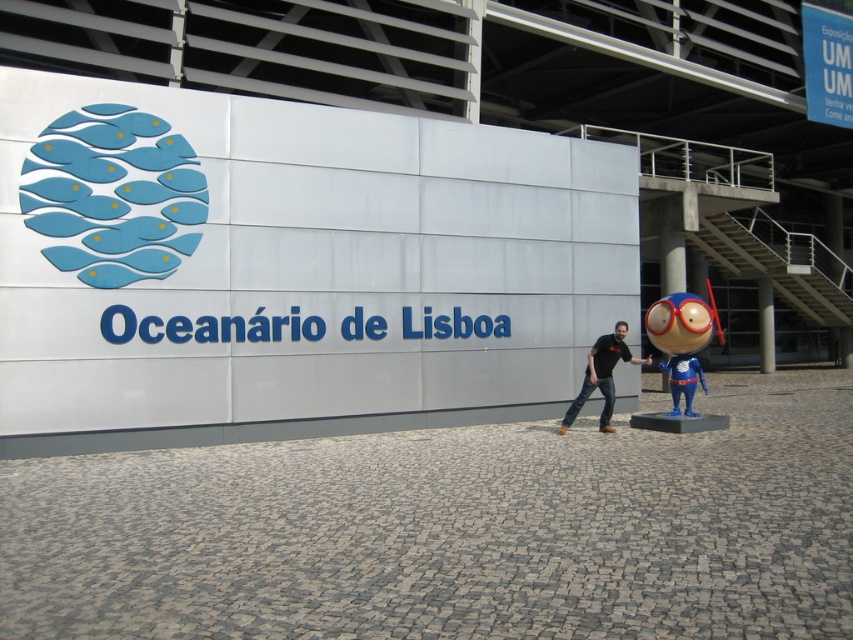
Does blue glossy toy at right appear on the right side of black matte shirt at center?

Correct, you'll find blue glossy toy at right to the right of black matte shirt at center.

The image size is (853, 640). What are the coordinates of `blue glossy toy at right` in the screenshot? It's located at (682, 340).